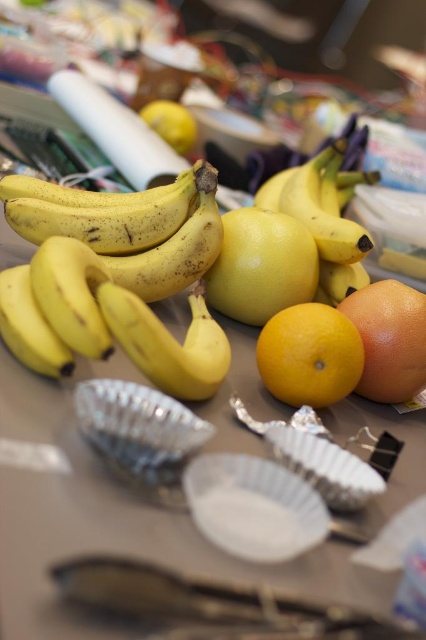
Question: Which object is closer to the camera taking this photo?

Choices:
 (A) yellow matte banana at center
 (B) white paper plate at center
 (C) glossy orange at center

Answer: (B)

Question: Does white paper plate at center lie in front of yellow matte bananas at left?

Choices:
 (A) yes
 (B) no

Answer: (A)

Question: Which object is farther from the camera taking this photo?

Choices:
 (A) glossy orange at center
 (B) matte yellow orange at center

Answer: (A)

Question: Does glossy orange at center have a greater width compared to yellow matte lemon at upper center?

Choices:
 (A) no
 (B) yes

Answer: (A)

Question: Which point is closer to the camera taking this photo?

Choices:
 (A) (279, 268)
 (B) (71, 353)

Answer: (B)

Question: Can you confirm if yellow matte bananas at upper left is thinner than yellow matte lemon at center?

Choices:
 (A) yes
 (B) no

Answer: (B)